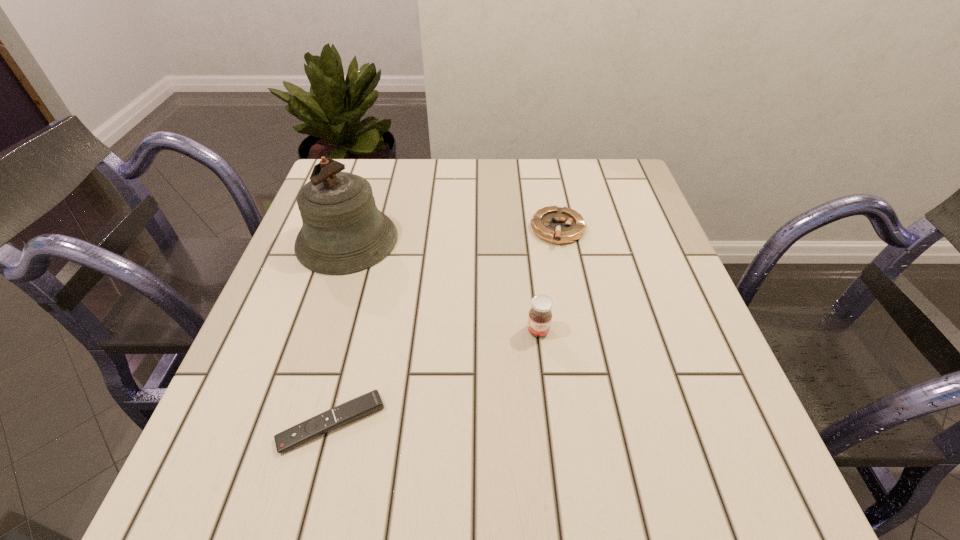
Locate an element on the screen. This screenshot has width=960, height=540. object that is at the near edge is located at coordinates (371, 402).

Where is `bell present at the left edge`? Image resolution: width=960 pixels, height=540 pixels. bell present at the left edge is located at coordinates (343, 232).

At what (x,y) coordinates should I click in order to perform the action: click on remote control at the left edge. Please return your answer as a coordinate pair (x, y). The width and height of the screenshot is (960, 540). Looking at the image, I should click on (371, 402).

Identify the location of object that is at the near left corner. The width and height of the screenshot is (960, 540). (371, 402).

This screenshot has width=960, height=540. In the image, there is a desktop. Identify the location of vacant space at the far edge. (469, 181).

At what (x,y) coordinates should I click in order to perform the action: click on free region at the near edge of the desktop. Please return your answer as a coordinate pair (x, y). The height and width of the screenshot is (540, 960). Looking at the image, I should click on (526, 495).

The width and height of the screenshot is (960, 540). Find the location of `free region at the left edge`. free region at the left edge is located at coordinates (250, 409).

Identify the location of free space at the right edge. (675, 429).

At what (x,y) coordinates should I click in order to perform the action: click on vacant space at the far left corner of the desktop. Please return your answer as a coordinate pair (x, y). The height and width of the screenshot is (540, 960). Looking at the image, I should click on (373, 168).

Where is `free location at the far right corner of the desktop`? Image resolution: width=960 pixels, height=540 pixels. free location at the far right corner of the desktop is located at coordinates coord(633,178).